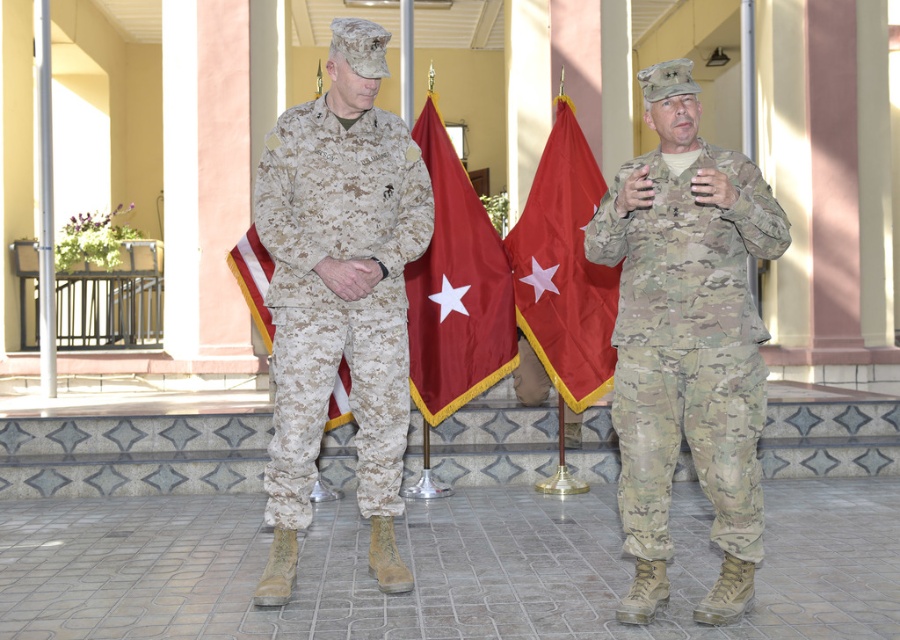
Between camouflage fabric uniform at center and red fabric flag at center, which one is positioned higher?

red fabric flag at center

Locate an element on the screen. This screenshot has width=900, height=640. camouflage fabric uniform at center is located at coordinates (338, 292).

Which is in front, point (419, 244) or point (567, 296)?

Point (419, 244) is more forward.

At what (x,y) coordinates should I click in order to perform the action: click on camouflage fabric uniform at center. Please return your answer as a coordinate pair (x, y). The image size is (900, 640). Looking at the image, I should click on (338, 292).

Who is taller, camouflage fabric uniform at center or camouflage fabric flag at center?

Standing taller between the two is camouflage fabric uniform at center.

Who is positioned more to the left, camouflage fabric uniform at center or camouflage fabric flag at center?

Positioned to the left is camouflage fabric flag at center.

Which is in front, point (282, 243) or point (262, 257)?

Positioned in front is point (282, 243).

Where is `camouflage fabric uniform at center`? camouflage fabric uniform at center is located at coordinates (338, 292).

From the picture: Is red fabric flag at center in front of camouflage fabric flag at center?

No, it is not.

Between point (531, 234) and point (327, 410), which one is positioned behind?

The point (531, 234) is behind.

Between point (595, 182) and point (245, 260), which one is positioned in front?

Positioned in front is point (245, 260).

This screenshot has width=900, height=640. In order to click on red fabric flag at center in this screenshot , I will do `click(564, 268)`.